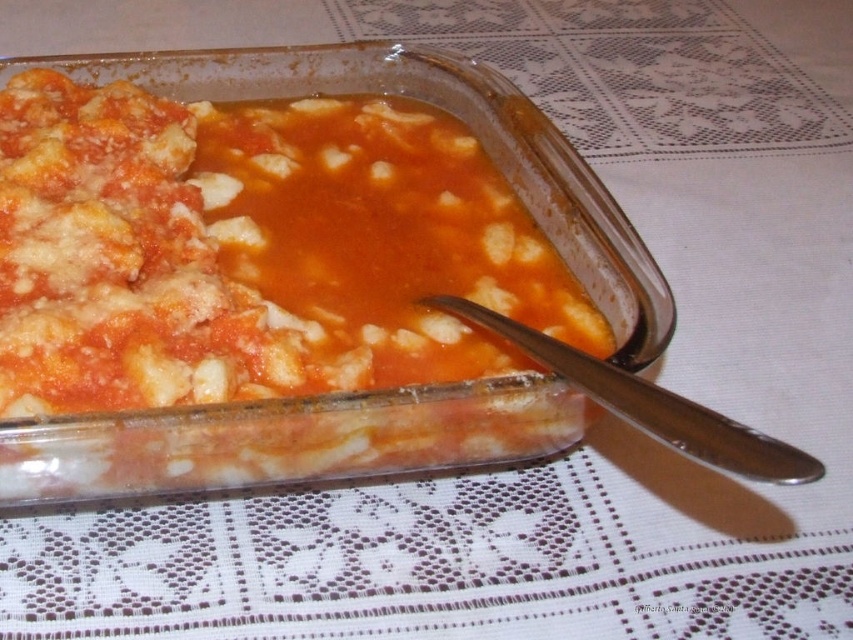
You are a chef preparing to serve a dish. You see the matte tomato sauce at center and the silver metallic spoon at lower right. Which object is closer to the top edge of the baking dish?

The matte tomato sauce at center is above the silver metallic spoon at lower right, so it is closer to the top edge of the baking dish.

You are a chef holding a spoon that is 6 inches long. You want to reach the matte tomato sauce at center to taste it. Can you reach it with your current spoon?

The matte tomato sauce at center is 9.03 inches away from viewer. Since the spoon is only 6 inches long, you cannot reach it with your current spoon.

You are a chef preparing to serve a dish. You see the matte tomato sauce at center and the silver metallic spoon at lower right. Which object is wider?

The matte tomato sauce at center might be wider than silver metallic spoon at lower right.